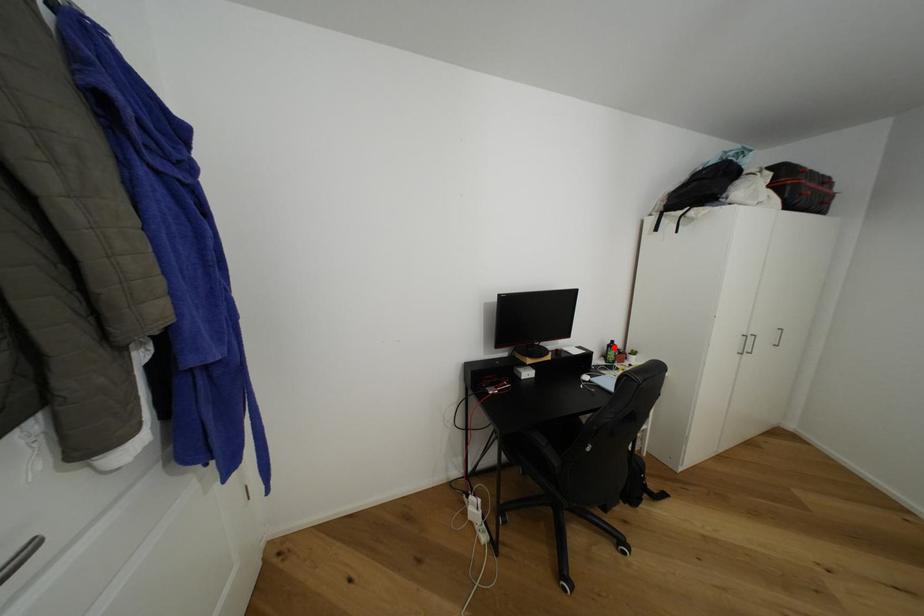
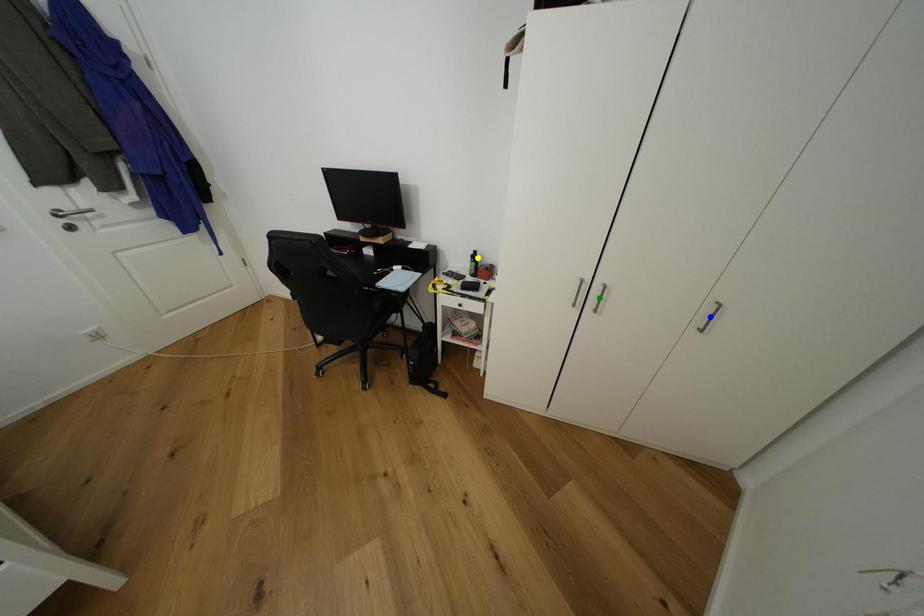
Question: I am providing you with two images of the same scene from different viewpoints. A red point is marked on the first image. You are given multiple points on the second image. Which point in image 2 is actually the same real-world point as the red point in image 1?

Choices:
 (A) blue point
 (B) green point
 (C) yellow point

Answer: (C)